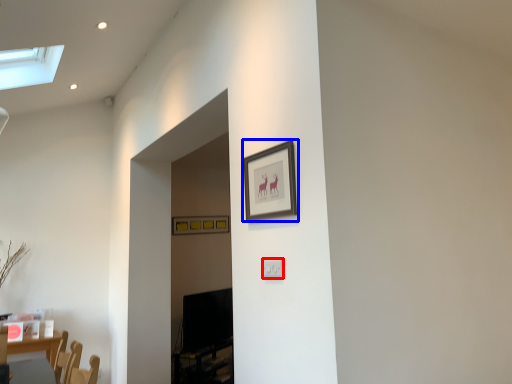
Question: Among these objects, which one is farthest to the camera, electric outlet (highlighted by a red box) or picture frame (highlighted by a blue box)?

Choices:
 (A) electric outlet
 (B) picture frame

Answer: (A)